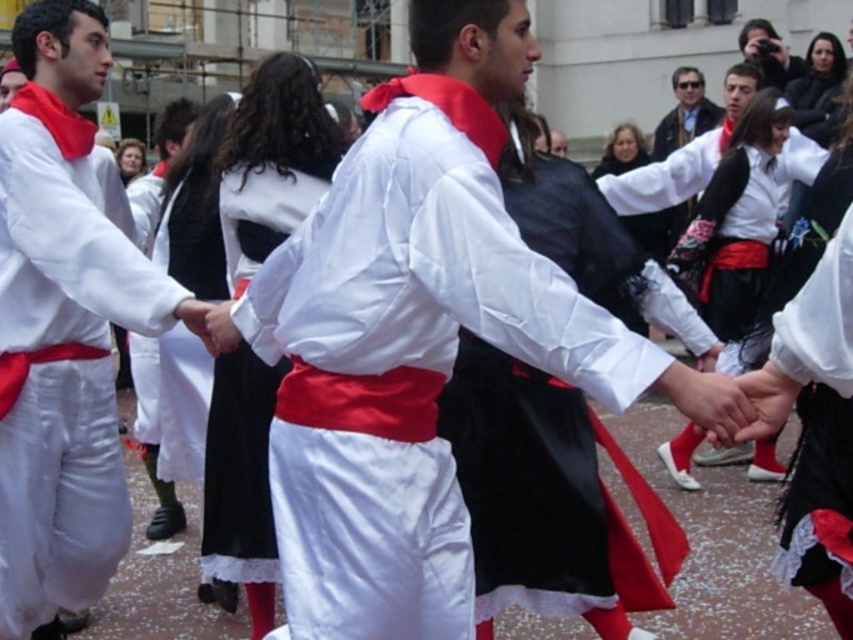
Question: Can you confirm if white satin shirt at center is positioned to the right of matte black camera at upper right?

Choices:
 (A) yes
 (B) no

Answer: (B)

Question: Can you confirm if white cotton shirt at center is positioned to the right of matte black jacket at upper center?

Choices:
 (A) no
 (B) yes

Answer: (A)

Question: Is matte black jacket at upper center smaller than matte black camera at upper right?

Choices:
 (A) no
 (B) yes

Answer: (B)

Question: Which of the following is the farthest from the observer?

Choices:
 (A) matte black jacket at upper center
 (B) matte black camera at upper right
 (C) white cotton shirt at center
 (D) white satin shirt at center

Answer: (A)

Question: Among these points, which one is nearest to the camera?

Choices:
 (A) pos(686,115)
 (B) pos(799,61)

Answer: (B)

Question: Which point appears closest to the camera in this image?

Choices:
 (A) coord(782,61)
 (B) coord(718,109)

Answer: (A)